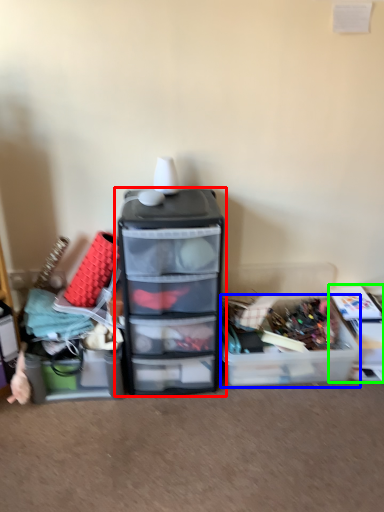
Question: Which is farther away from furniture (highlighted by a red box)? storage box (highlighted by a blue box) or storage box (highlighted by a green box)?

Choices:
 (A) storage box
 (B) storage box

Answer: (B)